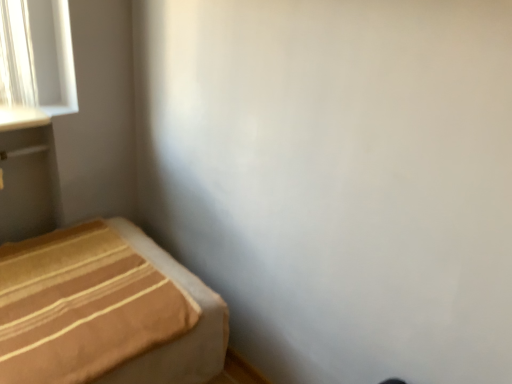
Question: Should I look upward or downward to see matte gray vanity at left?

Choices:
 (A) down
 (B) up

Answer: (B)